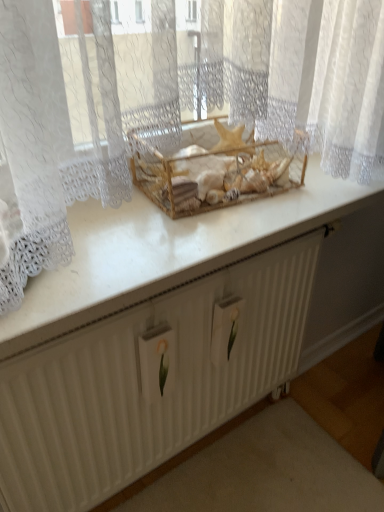
This screenshot has width=384, height=512. Identify the location of vacant space underneath white textured radiator at center (from a real-world perspective). (213, 439).